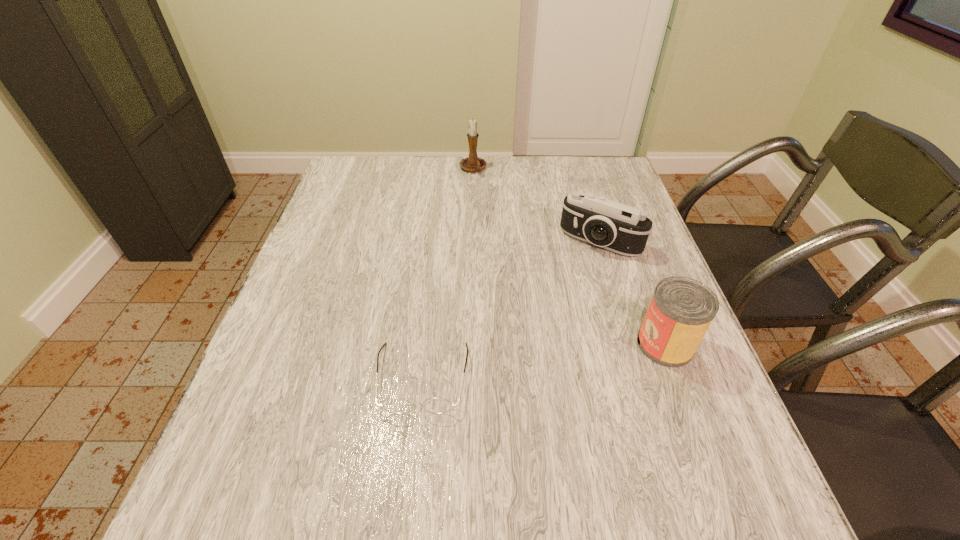
Image resolution: width=960 pixels, height=540 pixels. What are the coordinates of `blank space located on the front lens of the third nearest object` in the screenshot? It's located at (522, 345).

Locate an element on the screen. This screenshot has height=540, width=960. free spot located on the front lens of the third nearest object is located at coordinates (553, 301).

The image size is (960, 540). I want to click on object that is at the far edge, so click(x=473, y=163).

I want to click on object located in the near edge section of the desktop, so click(x=436, y=405).

At what (x,y) coordinates should I click in order to perform the action: click on can at the right edge. Please return your answer as a coordinate pair (x, y). This screenshot has height=540, width=960. Looking at the image, I should click on (681, 310).

Where is `camera positioned at the right edge`? This screenshot has width=960, height=540. camera positioned at the right edge is located at coordinates (x=623, y=229).

Where is `vacant space at the far edge`? This screenshot has height=540, width=960. vacant space at the far edge is located at coordinates (571, 178).

The width and height of the screenshot is (960, 540). What are the coordinates of `vacant space at the near edge` in the screenshot? It's located at (469, 435).

The image size is (960, 540). In order to click on vacant space at the left edge of the desktop in this screenshot , I will do `click(331, 215)`.

Find the location of `vacant space at the right edge of the desktop`. vacant space at the right edge of the desktop is located at coordinates (628, 267).